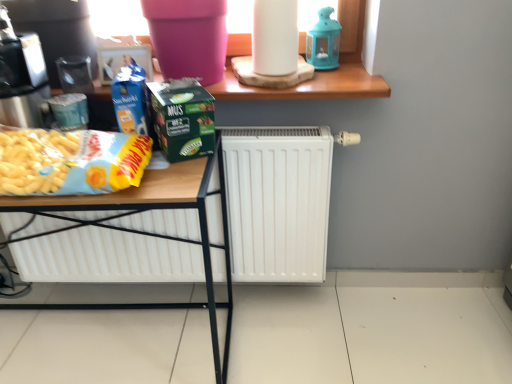
Find the location of a particular element. The height and width of the screenshot is (384, 512). free space in front of green matte carton at center is located at coordinates (175, 180).